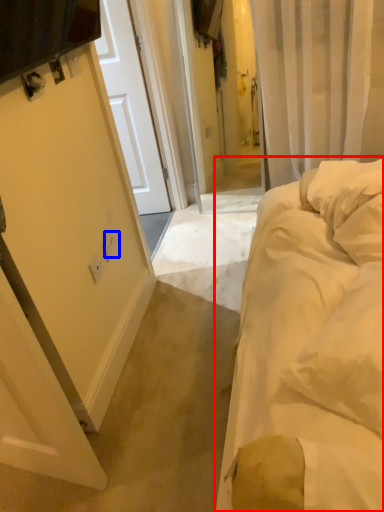
Question: Which object appears farthest to the camera in this image, bed (highlighted by a red box) or electric outlet (highlighted by a blue box)?

Choices:
 (A) bed
 (B) electric outlet

Answer: (B)